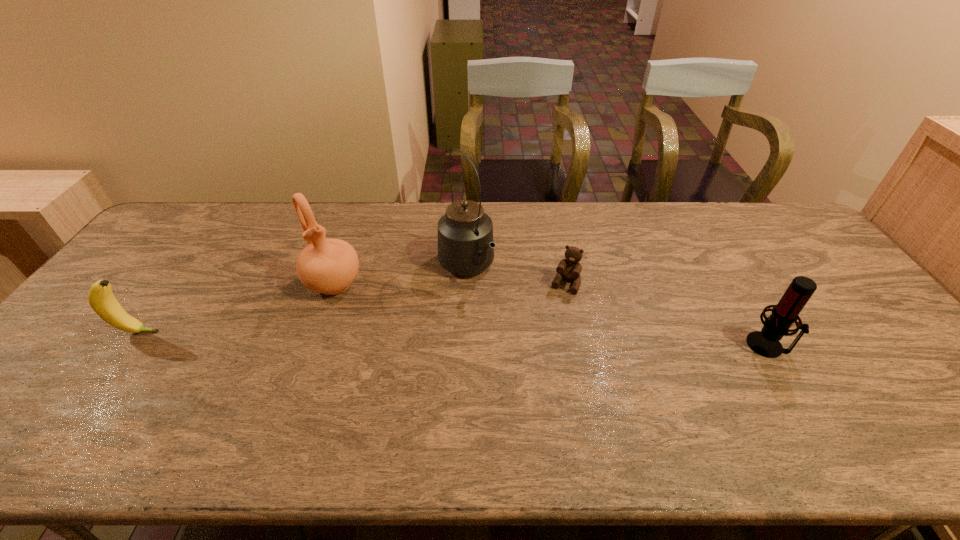
The image size is (960, 540). Identify the location of free space that satisfies the following two spatial constraints: 1. on the front side of the rightmost object; 2. on the left side of the tallest object. [x=464, y=345].